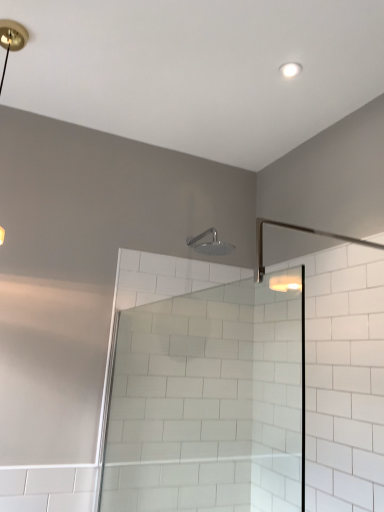
Measure the distance between matte gold light fixture at upper left and camera.

5.02 feet.

Identify the location of matte gold light fixture at upper left. (11, 40).

What is the approximate width of satin nickel shower head at upper center?

It is 24.49 centimeters.

The image size is (384, 512). I want to click on clear glass shower door at center, so click(x=208, y=403).

This screenshot has height=512, width=384. What are the coordinates of `lamp in front of the satin nickel shower head at upper center` in the screenshot? It's located at (11, 40).

Is satin nickel shower head at upper center further to the viewer compared to matte gold light fixture at upper left?

That is True.

What's the angular difference between satin nickel shower head at upper center and matte gold light fixture at upper left's facing directions?

The angle between the facing direction of satin nickel shower head at upper center and the facing direction of matte gold light fixture at upper left is 1.53 degrees.

Does satin nickel shower head at upper center have a greater height compared to matte gold light fixture at upper left?

Incorrect, the height of satin nickel shower head at upper center is not larger of that of matte gold light fixture at upper left.

Would you say matte gold light fixture at upper left is outside satin nickel shower head at upper center?

matte gold light fixture at upper left lies outside satin nickel shower head at upper center's area.

Which point is more forward, (5, 69) or (194, 247)?

The point (5, 69) is more forward.

Is matte gold light fixture at upper left looking in the opposite direction of satin nickel shower head at upper center?

matte gold light fixture at upper left is not turned away from satin nickel shower head at upper center.

Is matte gold light fixture at upper left wider than satin nickel shower head at upper center?

In fact, matte gold light fixture at upper left might be narrower than satin nickel shower head at upper center.

Considering the sizes of objects matte gold light fixture at upper left and clear glass shower door at center in the image provided, who is taller, matte gold light fixture at upper left or clear glass shower door at center?

clear glass shower door at center is taller.

Which is more to the left, matte gold light fixture at upper left or clear glass shower door at center?

matte gold light fixture at upper left.

I want to click on lamp above the clear glass shower door at center (from the image's perspective), so click(11, 40).

Is matte gold light fixture at upper left oriented away from clear glass shower door at center?

No, matte gold light fixture at upper left is not facing away from clear glass shower door at center.

From the image's perspective, is clear glass shower door at center positioned above or below satin nickel shower head at upper center?

clear glass shower door at center is situated lower than satin nickel shower head at upper center in the image.

Which of these two, clear glass shower door at center or satin nickel shower head at upper center, is thinner?

Thinner between the two is satin nickel shower head at upper center.

Based on the photo, is clear glass shower door at center positioned behind satin nickel shower head at upper center?

No, it is in front of satin nickel shower head at upper center.

From a real-world perspective, who is located higher, clear glass shower door at center or satin nickel shower head at upper center?

From a 3D spatial view, satin nickel shower head at upper center is above.

Consider the image. Could you tell me if satin nickel shower head at upper center is facing clear glass shower door at center?

No, satin nickel shower head at upper center is not aimed at clear glass shower door at center.

Is point (215, 229) positioned behind point (166, 479)?

That is True.

Locate an element on the screen. Image resolution: width=384 pixels, height=512 pixels. screen door that is in front of the satin nickel shower head at upper center is located at coordinates (208, 403).

Who is more distant, satin nickel shower head at upper center or clear glass shower door at center?

satin nickel shower head at upper center is behind.

Is clear glass shower door at center in contact with matte gold light fixture at upper left?

No, clear glass shower door at center is not next to matte gold light fixture at upper left.

Is clear glass shower door at center located outside matte gold light fixture at upper left?

clear glass shower door at center is positioned outside matte gold light fixture at upper left.

From a real-world perspective, which object rests below the other?

clear glass shower door at center, from a real-world perspective.

At what (x,y) coordinates should I click in order to perform the action: click on lamp in front of the satin nickel shower head at upper center. Please return your answer as a coordinate pair (x, y). The image size is (384, 512). Looking at the image, I should click on (11, 40).

You are a GUI agent. You are given a task and a screenshot of the screen. Output one action in this format:
    pyautogui.click(x=<x>, y=<y>)
    Task: Click on the shower below the matte gold light fixture at upper left (from a real-world perspective)
    
    Given the screenshot: What is the action you would take?
    pyautogui.click(x=210, y=244)

Estimate the real-world distances between objects in this image. Which object is closer to satin nickel shower head at upper center, matte gold light fixture at upper left or clear glass shower door at center?

clear glass shower door at center is closer to satin nickel shower head at upper center.

Looking at the image, which one is located closer to matte gold light fixture at upper left, satin nickel shower head at upper center or clear glass shower door at center?

The object closer to matte gold light fixture at upper left is satin nickel shower head at upper center.

Estimate the real-world distances between objects in this image. Which object is further from clear glass shower door at center, matte gold light fixture at upper left or satin nickel shower head at upper center?

matte gold light fixture at upper left lies further to clear glass shower door at center than the other object.

Estimate the real-world distances between objects in this image. Which object is further from matte gold light fixture at upper left, clear glass shower door at center or satin nickel shower head at upper center?

clear glass shower door at center.

Looking at the image, which one is located further to clear glass shower door at center, satin nickel shower head at upper center or matte gold light fixture at upper left?

Among the two, matte gold light fixture at upper left is located further to clear glass shower door at center.

Considering their positions, is clear glass shower door at center positioned closer to satin nickel shower head at upper center than matte gold light fixture at upper left?

Among the two, clear glass shower door at center is located nearer to satin nickel shower head at upper center.

Image resolution: width=384 pixels, height=512 pixels. Identify the location of lamp between clear glass shower door at center and satin nickel shower head at upper center along the z-axis. (11, 40).